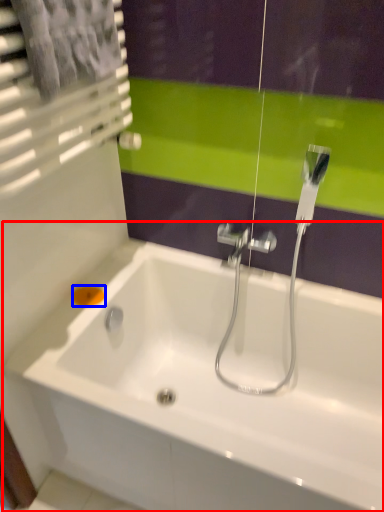
Question: Among these objects, which one is nearest to the camera, bathtub (highlighted by a red box) or soap (highlighted by a blue box)?

Choices:
 (A) bathtub
 (B) soap

Answer: (A)